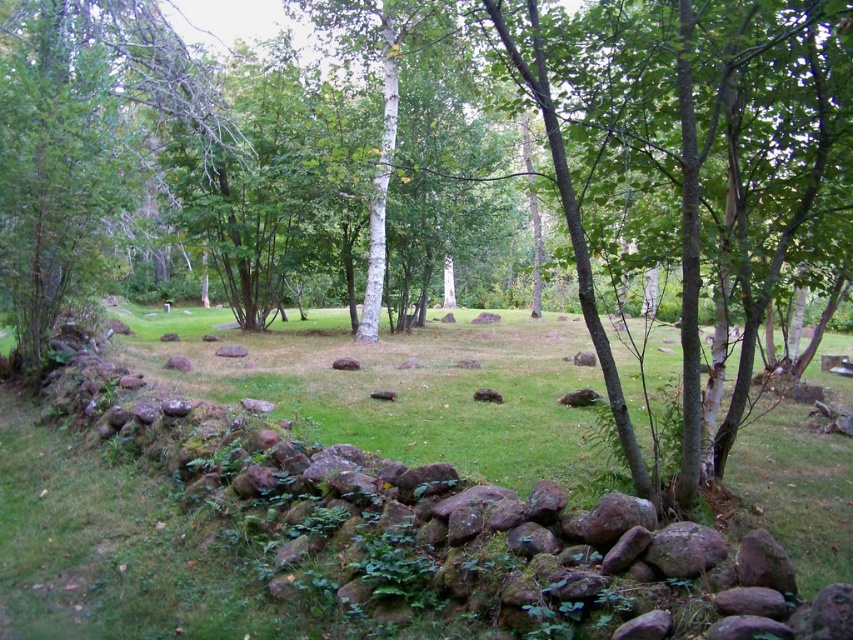
Based on the photo, you are standing in the park and want to take a photo of both the rocky wall at lower left and the smooth bark tree at center. Which object should you position closer to the camera to ensure both are in focus?

To ensure both the rocky wall at lower left and the smooth bark tree at center are in focus, position the rocky wall at lower left closer to the camera since it is shorter than the smooth bark tree at center, allowing for a deeper depth of field.